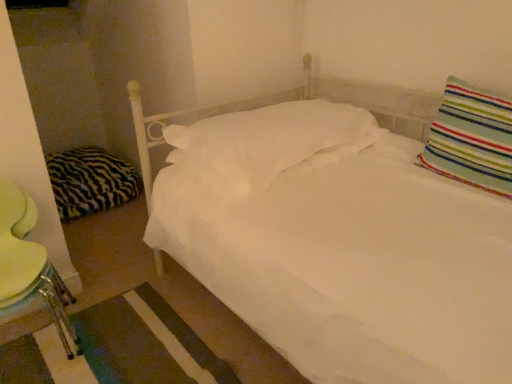
Locate an element on the screen. Image resolution: width=512 pixels, height=384 pixels. unoccupied area behind metallic green swivel chair at lower left is located at coordinates (103, 286).